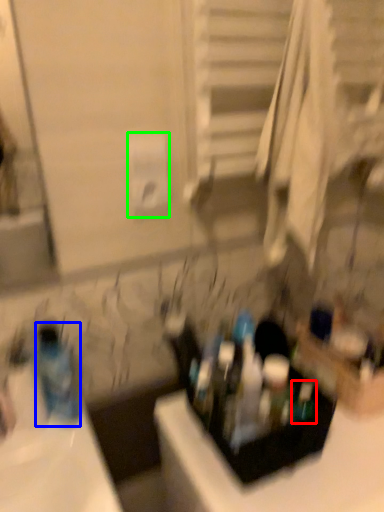
Question: Which object is the closest to the mouthwash (highlighted by a red box)? Choose among these: bottle (highlighted by a blue box) or toilet paper (highlighted by a green box).

Choices:
 (A) bottle
 (B) toilet paper

Answer: (A)